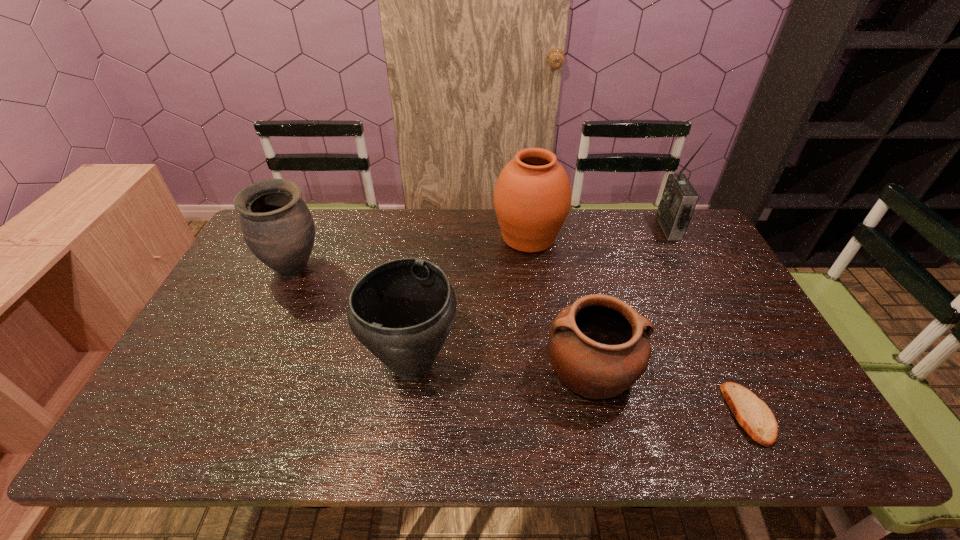
Locate an element on the screen. object that is at the far left corner is located at coordinates [277, 226].

I want to click on object that is at the far right corner, so click(679, 198).

Find the location of `object present at the near right corner`. object present at the near right corner is located at coordinates (754, 416).

Locate an element on the screen. The width and height of the screenshot is (960, 540). free space at the far edge is located at coordinates (610, 212).

Where is `blank space at the near edge`? This screenshot has width=960, height=540. blank space at the near edge is located at coordinates (445, 433).

The height and width of the screenshot is (540, 960). Find the location of `vacant space at the left edge of the desktop`. vacant space at the left edge of the desktop is located at coordinates (239, 321).

This screenshot has height=540, width=960. I want to click on blank space at the right edge, so point(741,297).

At what (x,y) coordinates should I click in order to perform the action: click on vacant space at the far right corner of the desktop. Please return your answer as a coordinate pair (x, y). Looking at the image, I should click on (683, 240).

Identify the location of free space at the near right corner of the desktop. Image resolution: width=960 pixels, height=540 pixels. (814, 430).

This screenshot has width=960, height=540. I want to click on vacant space that's between the pita bread and the radio receiver, so click(x=709, y=321).